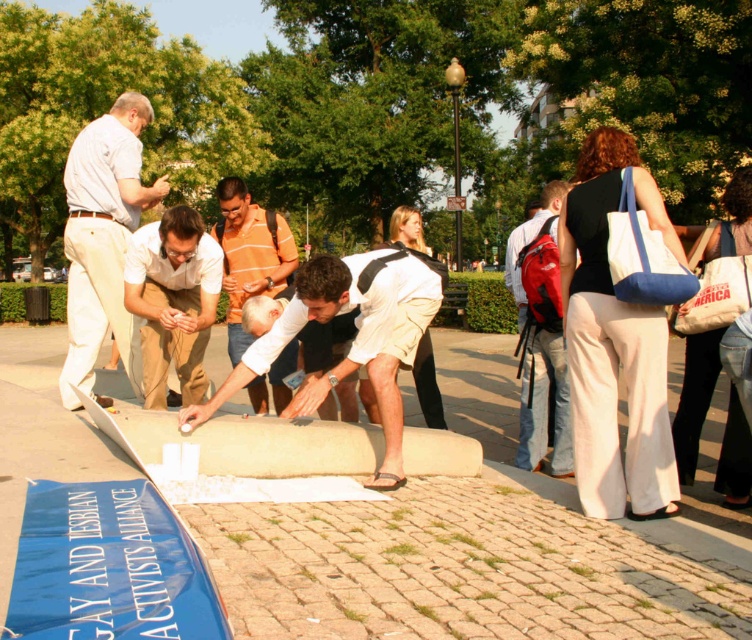
Question: Which point is closer to the camera taking this photo?

Choices:
 (A) (147, 294)
 (B) (559, 349)

Answer: (A)

Question: Is orange striped shirt at center to the right of matte red backpack at center from the viewer's perspective?

Choices:
 (A) no
 (B) yes

Answer: (A)

Question: Considering the real-world distances, which object is closest to the smooth concrete pavement at center?

Choices:
 (A) orange striped shirt at center
 (B) light beige pants at center
 (C) light brown cotton shirt at center
 (D) matte red backpack at center

Answer: (C)

Question: Among these objects, which one is nearest to the camera?

Choices:
 (A) matte red backpack at center
 (B) smooth concrete pavement at center
 (C) light brown cotton shirt at center

Answer: (B)

Question: Can you confirm if smooth concrete pavement at center is thinner than matte red backpack at center?

Choices:
 (A) yes
 (B) no

Answer: (B)

Question: Is smooth concrete pavement at center to the left of smooth concrete cylinder at center from the viewer's perspective?

Choices:
 (A) yes
 (B) no

Answer: (B)